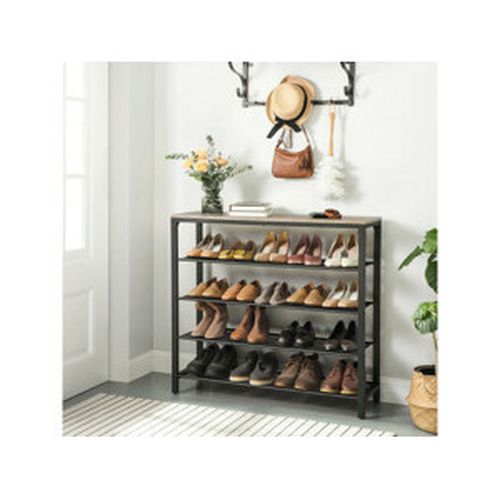
The image size is (500, 500). Identify the location of shelves. (265, 387), (265, 343), (289, 304), (282, 263).